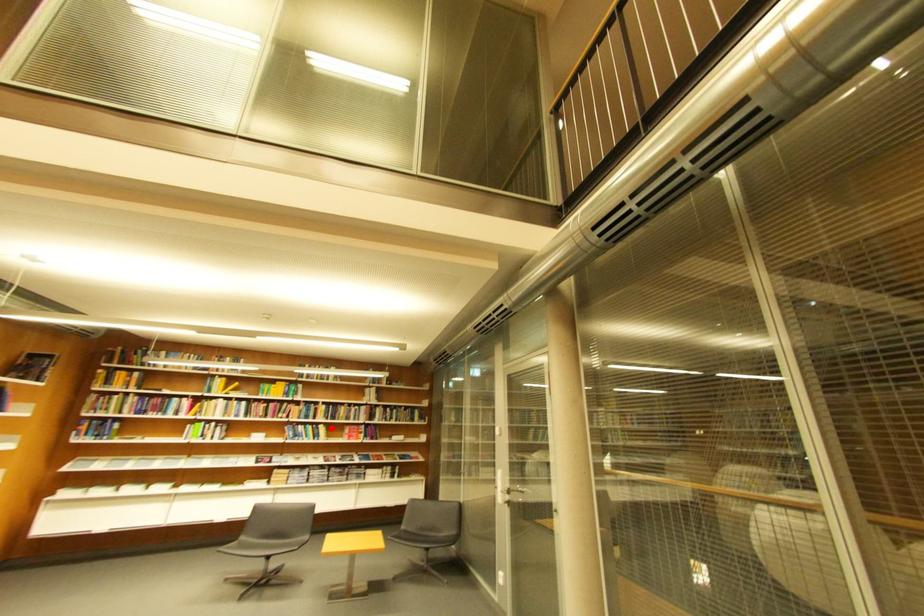
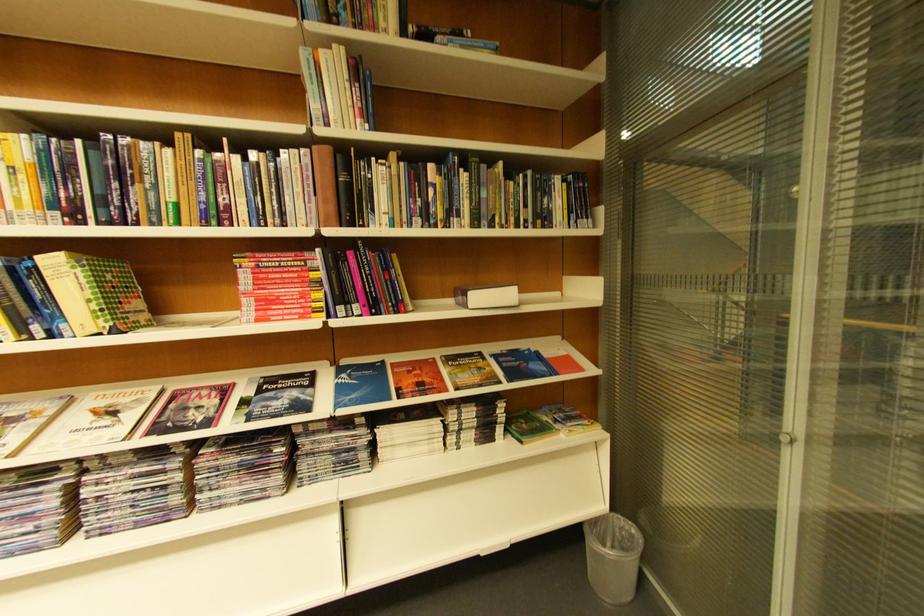
Question: A red point is marked in image1. In image2, is the corresponding 3D point closer to the camera or farther? Reply with the corresponding letter.

Choices:
 (A) The corresponding 3D point is closer.
 (B) The corresponding 3D point is farther.

Answer: (A)